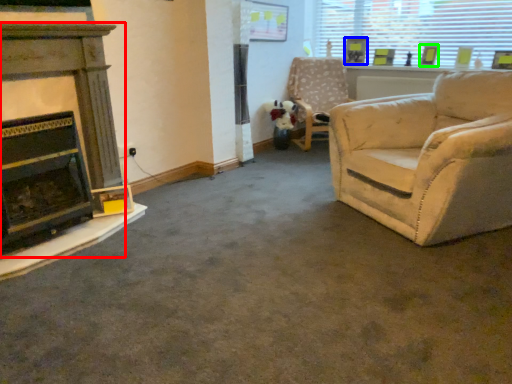
Question: Which object is positioned farthest from fireplace (highlighted by a red box)? Select from picture frame (highlighted by a blue box) and picture frame (highlighted by a green box).

Choices:
 (A) picture frame
 (B) picture frame

Answer: (B)